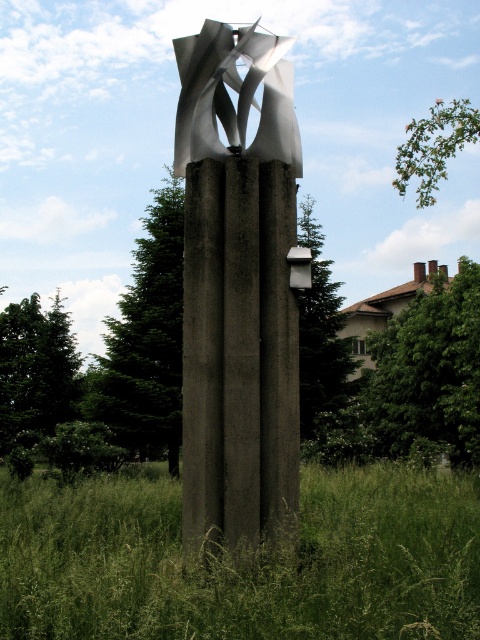
You are standing in front of the sculpture and want to take a photo. The two points, point [336,563] and point [228,481], are on the sculpture. Which point will appear larger in the photo?

Point [336,563] will appear larger in the photo because it is closer to the camera than point [228,481].

From the picture: You are standing in a park and want to take a photo of the polished silver sculpture at center. If your camera has a maximum focus range of 5 meters, will you need to move closer to capture a clear image?

The polished silver sculpture at center is 5.46 meters away from the camera, which exceeds the camera maximum focus range of 5 meters. Therefore, you need to move closer to ensure the sculpture is in focus.